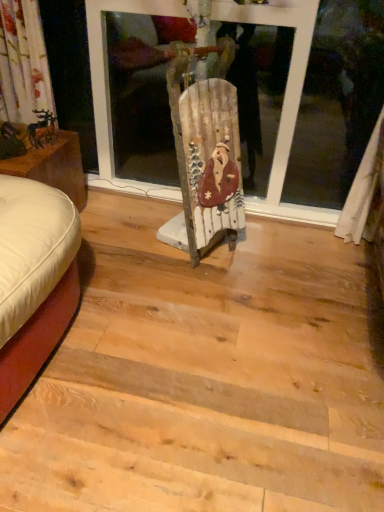
This screenshot has width=384, height=512. Describe the element at coordinates (53, 166) in the screenshot. I see `white leather ottoman at left` at that location.

Where is `white leather ottoman at left`? Image resolution: width=384 pixels, height=512 pixels. white leather ottoman at left is located at coordinates (53, 166).

Locate an element on the screen. The image size is (384, 512). metallic gold reindeer at left is located at coordinates (42, 128).

Describe the element at coordinates (42, 128) in the screenshot. Image resolution: width=384 pixels, height=512 pixels. I see `metallic gold reindeer at left` at that location.

Identify the location of white leather ottoman at left. The height and width of the screenshot is (512, 384). 53,166.

Can you confirm if white leather ottoman at left is positioned to the right of metallic gold reindeer at left?

Incorrect, white leather ottoman at left is not on the right side of metallic gold reindeer at left.

Which object is closer to the camera taking this photo, white leather ottoman at left or metallic gold reindeer at left?

white leather ottoman at left is in front.

Which is nearer, (36, 156) or (47, 139)?

Positioned in front is point (36, 156).

From the image's perspective, is white leather ottoman at left located beneath metallic gold reindeer at left?

Yes.

From a real-world perspective, is white leather ottoman at left on metallic gold reindeer at left?

No, from a real-world perspective, white leather ottoman at left is not above metallic gold reindeer at left.

Between white leather ottoman at left and metallic gold reindeer at left, which one has smaller width?

metallic gold reindeer at left.

Who is shorter, white leather ottoman at left or metallic gold reindeer at left?

metallic gold reindeer at left.

Considering the relative sizes of white leather ottoman at left and metallic gold reindeer at left in the image provided, is white leather ottoman at left smaller than metallic gold reindeer at left?

No, white leather ottoman at left is not smaller than metallic gold reindeer at left.

Choose the correct answer: Is white leather ottoman at left inside metallic gold reindeer at left or outside it?

white leather ottoman at left exists outside the volume of metallic gold reindeer at left.

In the scene shown: Does white leather ottoman at left touch metallic gold reindeer at left?

No, white leather ottoman at left is not in contact with metallic gold reindeer at left.

Is white leather ottoman at left oriented towards metallic gold reindeer at left?

No, white leather ottoman at left is not aimed at metallic gold reindeer at left.

The width and height of the screenshot is (384, 512). Find the location of `art behind the white leather ottoman at left`. art behind the white leather ottoman at left is located at coordinates pyautogui.click(x=42, y=128).

Which object is positioned more to the left, metallic gold reindeer at left or white leather ottoman at left?

Positioned to the left is white leather ottoman at left.

Is metallic gold reindeer at left positioned before white leather ottoman at left?

No, metallic gold reindeer at left is behind white leather ottoman at left.

Which is nearer, [46,142] or [36,160]?

Point [46,142].

From the image's perspective, which is above, metallic gold reindeer at left or white leather ottoman at left?

metallic gold reindeer at left, from the image's perspective.

From a real-world perspective, between metallic gold reindeer at left and white leather ottoman at left, who is vertically higher?

In real-world perspective, metallic gold reindeer at left is above.

Can you confirm if metallic gold reindeer at left is wider than white leather ottoman at left?

Incorrect, the width of metallic gold reindeer at left does not surpass that of white leather ottoman at left.

Which of these two, metallic gold reindeer at left or white leather ottoman at left, stands shorter?

metallic gold reindeer at left is shorter.

Between metallic gold reindeer at left and white leather ottoman at left, which one has smaller size?

metallic gold reindeer at left.

Does metallic gold reindeer at left contain white leather ottoman at left?

Actually, white leather ottoman at left is outside metallic gold reindeer at left.

Are metallic gold reindeer at left and white leather ottoman at left located far from each other?

No, there isn't a large distance between metallic gold reindeer at left and white leather ottoman at left.

Does metallic gold reindeer at left turn towards white leather ottoman at left?

No, metallic gold reindeer at left does not turn towards white leather ottoman at left.

Locate an element on the screen. The image size is (384, 512). art lying on the right of white leather ottoman at left is located at coordinates (42, 128).

Locate an element on the screen. Image resolution: width=384 pixels, height=512 pixels. art above the white leather ottoman at left (from a real-world perspective) is located at coordinates (42, 128).

Find the location of a particular element. This screenshot has height=512, width=384. furniture in front of the metallic gold reindeer at left is located at coordinates (53, 166).